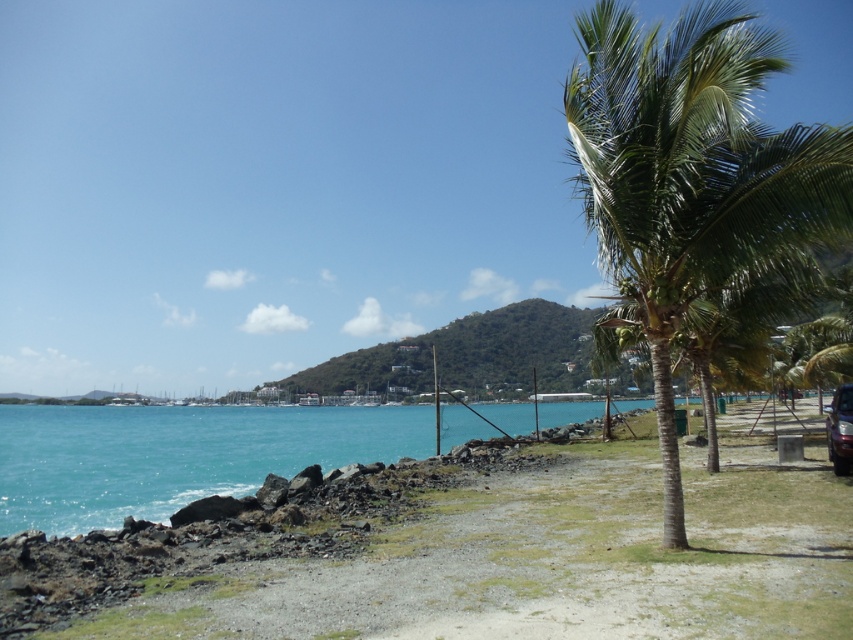
Is turquoise water at lower left to the right of metallic silver car at right from the viewer's perspective?

In fact, turquoise water at lower left is to the left of metallic silver car at right.

Identify the location of turquoise water at lower left. (x=177, y=456).

Can you confirm if green leafy palm tree at right is positioned above metallic silver car at right?

Indeed, green leafy palm tree at right is positioned over metallic silver car at right.

From the picture: Who is shorter, green leafy palm tree at right or metallic silver car at right?

Standing shorter between the two is metallic silver car at right.

Does point (741, 81) come farther from viewer compared to point (828, 442)?

That is False.

At what (x,y) coordinates should I click in order to perform the action: click on green leafy palm tree at right. Please return your answer as a coordinate pair (x, y). This screenshot has width=853, height=640. Looking at the image, I should click on (691, 173).

Can you confirm if smooth sand beach at lower center is positioned to the right of turquoise water at lower left?

Indeed, smooth sand beach at lower center is positioned on the right side of turquoise water at lower left.

Image resolution: width=853 pixels, height=640 pixels. What do you see at coordinates (473, 554) in the screenshot?
I see `smooth sand beach at lower center` at bounding box center [473, 554].

Image resolution: width=853 pixels, height=640 pixels. Identify the location of smooth sand beach at lower center. (473, 554).